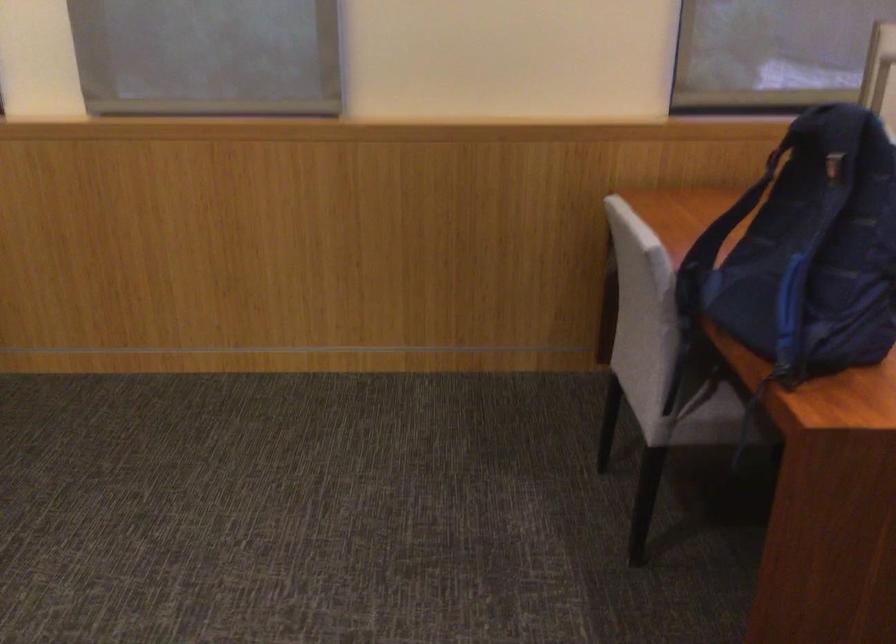
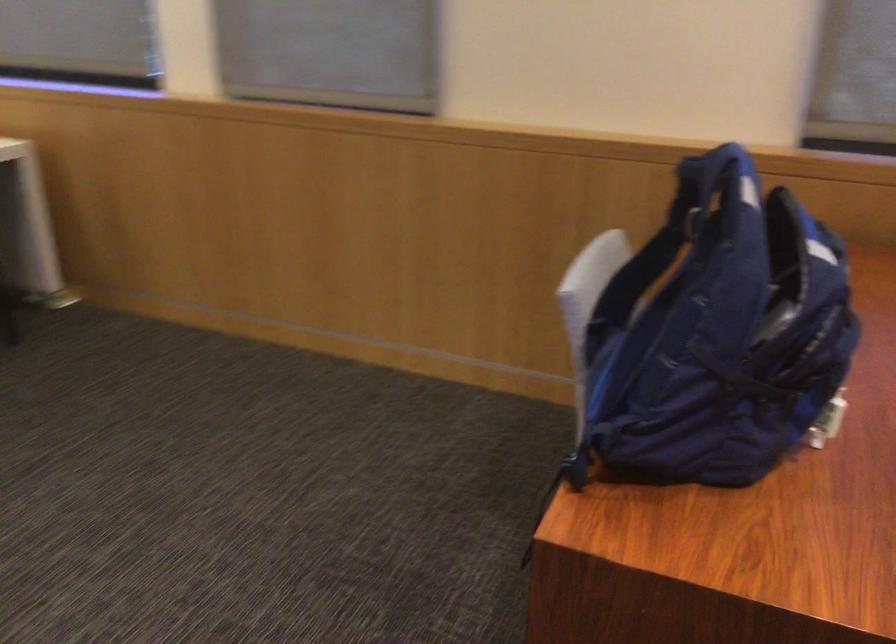
The images are taken continuously from a first-person perspective. In which direction are you moving?

The cameraman walked toward right, forward.